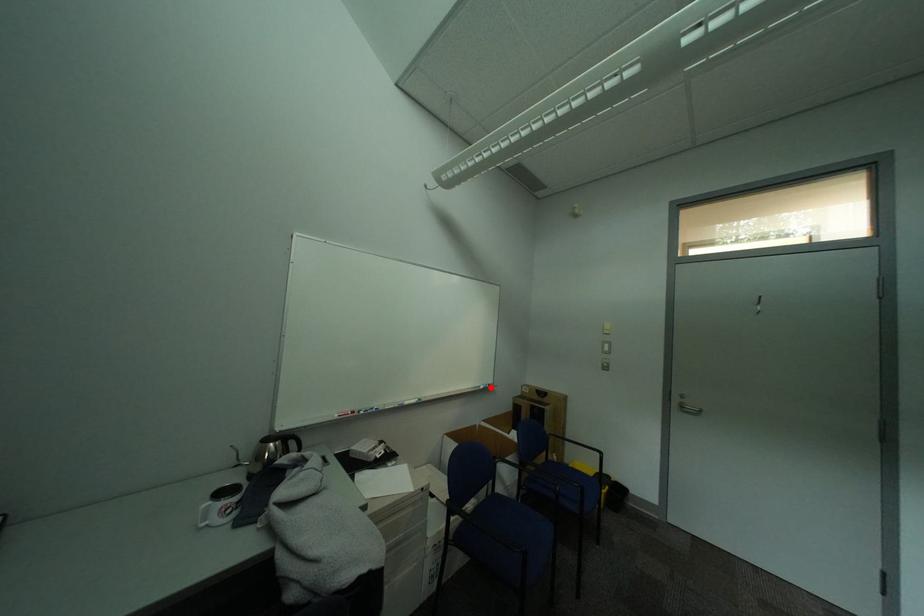
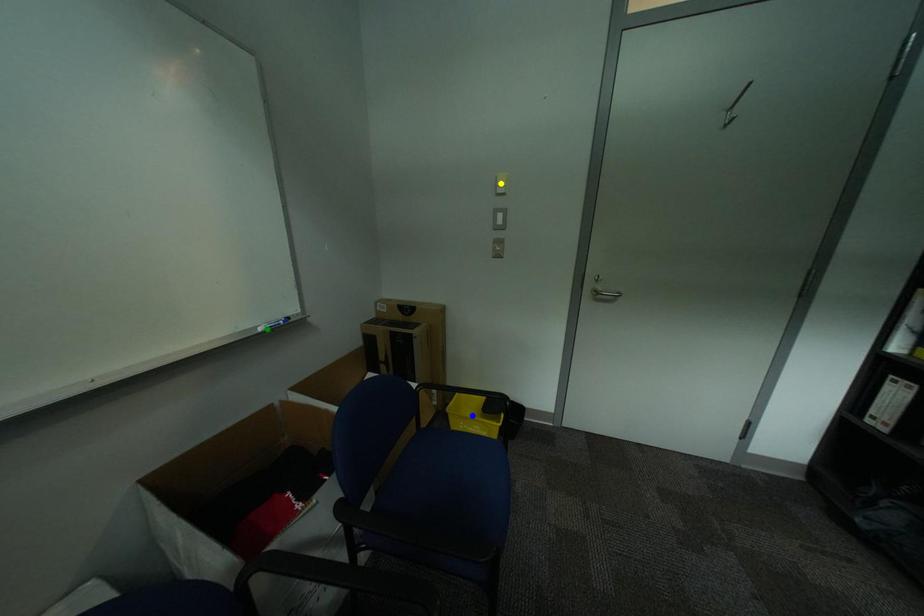
Question: I am providing you with two images of the same scene from different viewpoints. A red point is marked on the first image. You are given multiple points on the second image. Which point in image 2 is actually the same real-world point as the red point in image 1?

Choices:
 (A) yellow point
 (B) blue point
 (C) green point

Answer: (C)